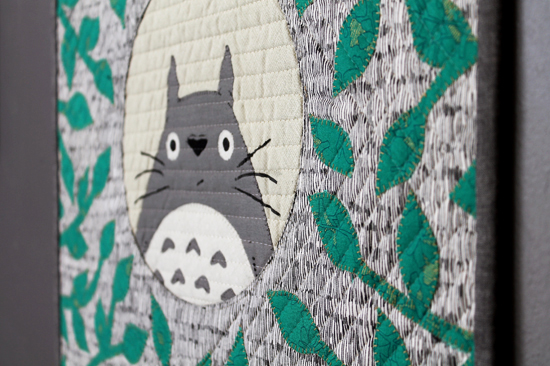
Find the location of a particular element. The image size is (550, 366). light grey background (maybe wall) is located at coordinates (533, 101).